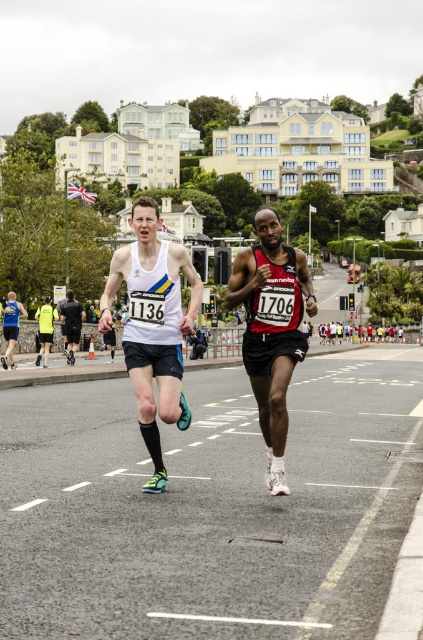
Is white matte tank top at center below black matte running shoe at center?

No, white matte tank top at center is not below black matte running shoe at center.

Can you confirm if white matte tank top at center is wider than black matte running shoe at center?

Indeed, white matte tank top at center has a greater width compared to black matte running shoe at center.

Find the location of `white matte tank top at center`. white matte tank top at center is located at coordinates (153, 324).

The width and height of the screenshot is (423, 640). Find the location of `white matte tank top at center`. white matte tank top at center is located at coordinates (153, 324).

Is black matte running shoe at center to the right of black matte shorts at center from the viewer's perspective?

Yes, black matte running shoe at center is to the right of black matte shorts at center.

Between point (274, 353) and point (71, 346), which one is positioned behind?

The point (71, 346) is behind.

Where is `black matte running shoe at center`? black matte running shoe at center is located at coordinates [271, 330].

Based on the photo, is white matte tank top at center to the right of black matte shorts at center from the viewer's perspective?

Correct, you'll find white matte tank top at center to the right of black matte shorts at center.

Is white matte tank top at center positioned behind black matte shorts at center?

That is False.

Does point (137, 355) come behind point (68, 301)?

No, (137, 355) is closer to viewer.

You are a GUI agent. You are given a task and a screenshot of the screen. Output one action in this format:
    pyautogui.click(x=<x>, y=<y>)
    Task: Click on the white matte tank top at center
    The image size is (423, 640).
    Given the screenshot: What is the action you would take?
    pyautogui.click(x=153, y=324)